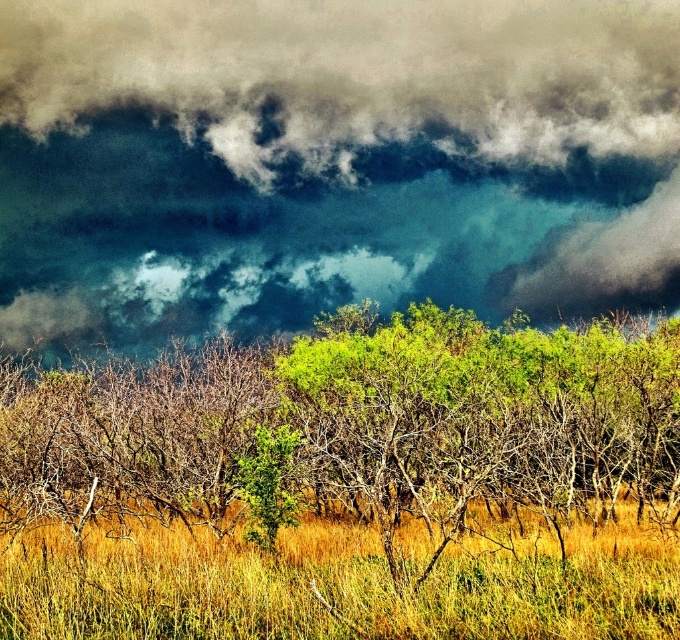
You are standing in the landscape and looking up at the dark cloud at upper center and the green leafy tree at center. Which object is directly above the other?

The dark cloud at upper center is positioned over the green leafy tree at center, so it is directly above it.

You are an observer standing in the middle of the field looking at the dark cloud at upper center and the green leafy tree at center. Which object is positioned to the right side from your perspective?

The dark cloud at upper center is positioned to the right of the green leafy tree at center.

Based on the scene, can you determine if the dark cloud at upper center is wider than the yellow grassy at center?

The dark cloud at upper center might be wider than yellow grassy at center according to the description.